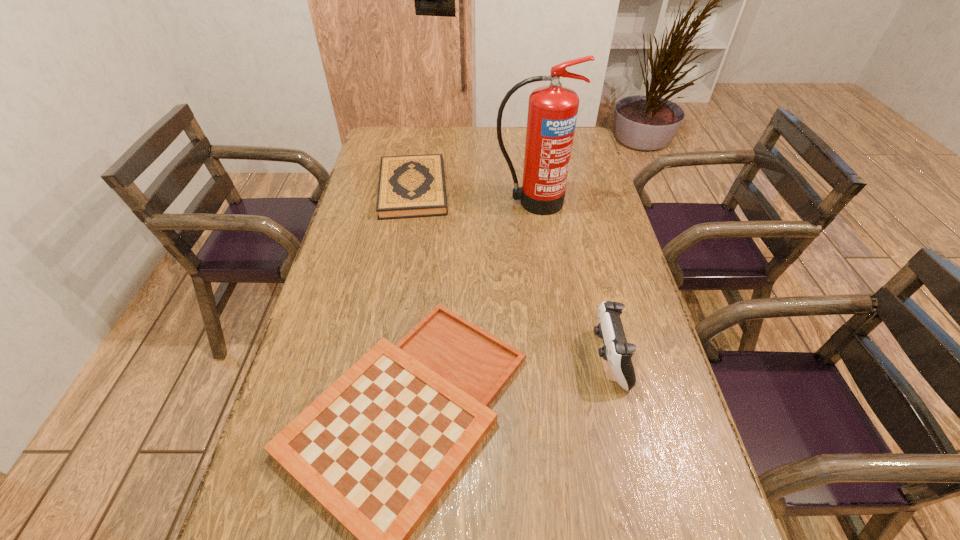
This screenshot has width=960, height=540. Identify the location of vacant space that's between the tallest object and the control. (570, 280).

Select which object appears as the closest to the third tallest object. Please provide its 2D coordinates. Your answer should be formatted as a tuple, i.e. [(x, y)], where the tuple contains the x and y coordinates of a point satisfying the conditions above.

[(552, 110)]

Identify which object is located as the second nearest to the third tallest object. Please provide its 2D coordinates. Your answer should be formatted as a tuple, i.e. [(x, y)], where the tuple contains the x and y coordinates of a point satisfying the conditions above.

[(377, 449)]